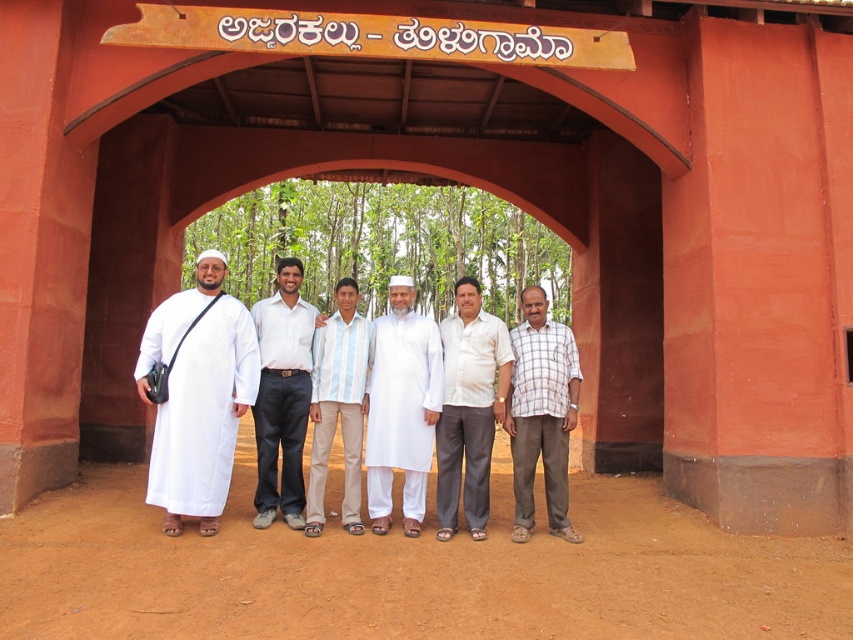
Question: Does white matte/soft fabric at center appear on the left side of plaid cotton shirt at center?

Choices:
 (A) no
 (B) yes

Answer: (B)

Question: Does white cotton kurta at center have a greater width compared to striped cotton shirt at center?

Choices:
 (A) no
 (B) yes

Answer: (B)

Question: Considering the real-world distances, which object is farthest from the white cotton shirt at center?

Choices:
 (A) white matte/soft fabric at center
 (B) white matte shirt at center

Answer: (B)

Question: Which object is positioned closest to the plaid cotton shirt at center?

Choices:
 (A) striped cotton shirt at center
 (B) white matte/soft fabric at center

Answer: (A)

Question: Does white cotton kurta at center have a greater width compared to plaid cotton shirt at center?

Choices:
 (A) no
 (B) yes

Answer: (A)

Question: Which object is farther from the camera taking this photo?

Choices:
 (A) plaid cotton shirt at center
 (B) striped cotton shirt at center

Answer: (A)